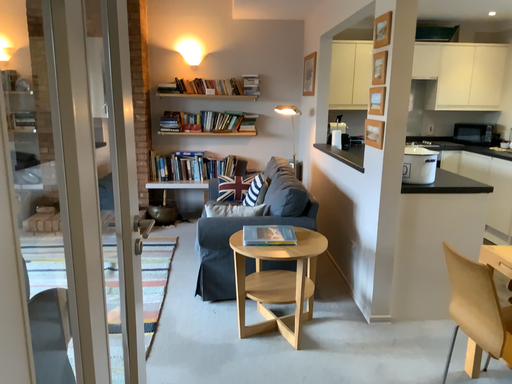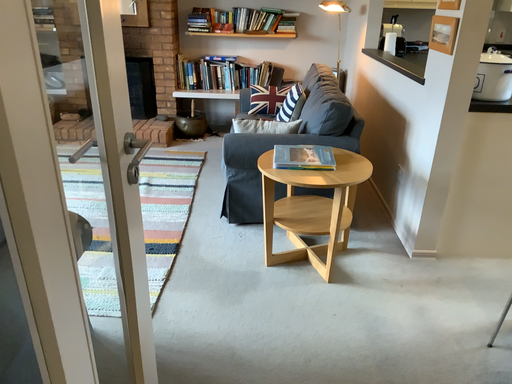
Question: How did the camera likely rotate when shooting the video?

Choices:
 (A) rotated downward
 (B) rotated upward

Answer: (A)